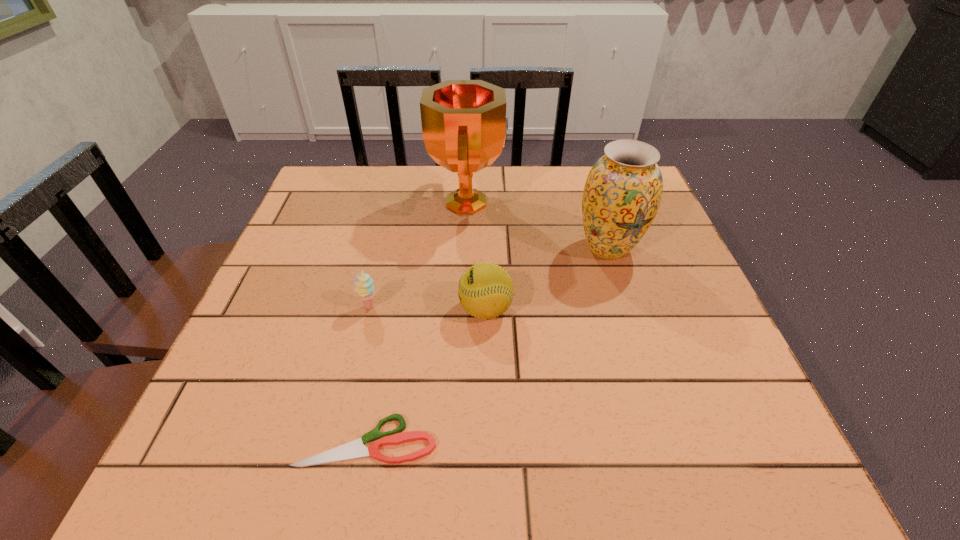
The width and height of the screenshot is (960, 540). I want to click on vacant space at the right edge of the desktop, so click(665, 406).

Locate an element on the screen. Image resolution: width=960 pixels, height=540 pixels. vacant region at the near right corner is located at coordinates (691, 466).

The image size is (960, 540). In order to click on vacant space that's between the award and the rightmost object in this screenshot , I will do `click(538, 225)`.

Find the location of `unoccupied area between the award and the vase`. unoccupied area between the award and the vase is located at coordinates (538, 225).

Where is `vacant space that's between the rightmost object and the shortest object`? This screenshot has width=960, height=540. vacant space that's between the rightmost object and the shortest object is located at coordinates (488, 345).

This screenshot has width=960, height=540. I want to click on vacant area between the softball and the sherbert, so click(427, 308).

Image resolution: width=960 pixels, height=540 pixels. I want to click on empty space that is in between the shortest object and the sherbert, so click(x=368, y=374).

The height and width of the screenshot is (540, 960). Find the location of `vacant space that's between the sherbert and the award`. vacant space that's between the sherbert and the award is located at coordinates (419, 255).

Image resolution: width=960 pixels, height=540 pixels. I want to click on blank region between the award and the shortest object, so click(x=418, y=322).

The image size is (960, 540). What are the coordinates of `free area in between the softball and the fourth shortest object` in the screenshot? It's located at (547, 279).